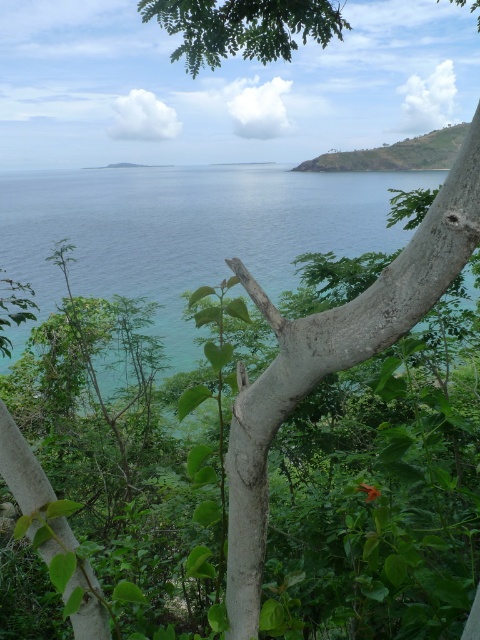
Question: Is green water at center to the left of green grassy hill at upper right from the viewer's perspective?

Choices:
 (A) yes
 (B) no

Answer: (A)

Question: Is green rough bark tree at center to the left of green grassy hill at upper right from the viewer's perspective?

Choices:
 (A) no
 (B) yes

Answer: (B)

Question: Is green water at center thinner than green grassy hill at upper right?

Choices:
 (A) no
 (B) yes

Answer: (A)

Question: Which of these objects is positioned farthest from the green water at center?

Choices:
 (A) green rough bark tree at center
 (B) green grassy hill at upper right

Answer: (A)

Question: Which object is positioned closest to the green rough bark tree at center?

Choices:
 (A) green water at center
 (B) green grassy hill at upper right

Answer: (A)

Question: Among these objects, which one is nearest to the camera?

Choices:
 (A) green grassy hill at upper right
 (B) green rough bark tree at center

Answer: (B)